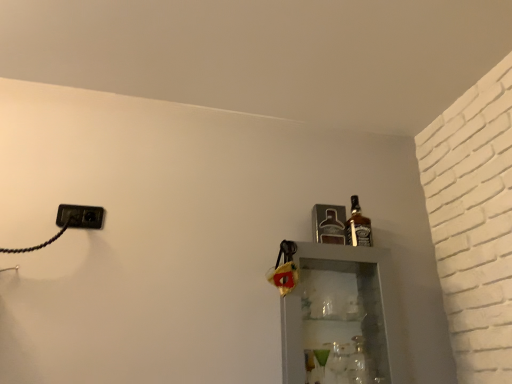
Question: Is brown glass bottle at upper right, marked as the third bottle in a bottom-to-top arrangement, outside black plastic outlet at left?

Choices:
 (A) no
 (B) yes

Answer: (B)

Question: From a real-world perspective, is brown glass bottle at upper right, marked as the 1th bottle in a top-to-bottom arrangement, physically above black plastic outlet at left?

Choices:
 (A) no
 (B) yes

Answer: (B)

Question: Is brown glass bottle at upper right, marked as the third bottle in a bottom-to-top arrangement, wider than black plastic outlet at left?

Choices:
 (A) yes
 (B) no

Answer: (A)

Question: Is brown glass bottle at upper right, marked as the 1th bottle in a top-to-bottom arrangement, oriented towards black plastic outlet at left?

Choices:
 (A) no
 (B) yes

Answer: (A)

Question: Is brown glass bottle at upper right, marked as the third bottle in a bottom-to-top arrangement, bigger than black plastic outlet at left?

Choices:
 (A) no
 (B) yes

Answer: (B)

Question: From a real-world perspective, is clear glass bottle at right, the first bottle in the bottom-to-top sequence, positioned above or below metallic silver bottle at upper right, the 2th bottle when ordered from bottom to top?

Choices:
 (A) below
 (B) above

Answer: (A)

Question: Is point (356, 380) closer or farther from the camera than point (331, 206)?

Choices:
 (A) farther
 (B) closer

Answer: (B)

Question: In terms of width, does clear glass bottle at right, marked as the third bottle in a top-to-bottom arrangement, look wider or thinner when compared to metallic silver bottle at upper right, arranged as the 2th bottle when viewed from the top?

Choices:
 (A) thin
 (B) wide

Answer: (A)

Question: Is clear glass bottle at right, marked as the third bottle in a top-to-bottom arrangement, taller or shorter than metallic silver bottle at upper right, arranged as the 2th bottle when viewed from the top?

Choices:
 (A) tall
 (B) short

Answer: (A)

Question: Is brown glass bottle at upper right, marked as the third bottle in a bottom-to-top arrangement, bigger or smaller than clear glass bottle at right, the first bottle in the bottom-to-top sequence?

Choices:
 (A) big
 (B) small

Answer: (A)

Question: From a real-world perspective, is brown glass bottle at upper right, marked as the third bottle in a bottom-to-top arrangement, above or below clear glass bottle at right, marked as the third bottle in a top-to-bottom arrangement?

Choices:
 (A) below
 (B) above

Answer: (B)

Question: Is point (354, 243) closer or farther from the camera than point (354, 365)?

Choices:
 (A) farther
 (B) closer

Answer: (A)

Question: Visually, is brown glass bottle at upper right, marked as the third bottle in a bottom-to-top arrangement, positioned to the left or to the right of clear glass bottle at right, marked as the third bottle in a top-to-bottom arrangement?

Choices:
 (A) left
 (B) right

Answer: (B)

Question: Is metallic silver bottle at upper right, arranged as the 2th bottle when viewed from the top, in front of or behind black plastic outlet at left in the image?

Choices:
 (A) behind
 (B) front

Answer: (A)

Question: From the image's perspective, is metallic silver bottle at upper right, the 2th bottle when ordered from bottom to top, located above or below black plastic outlet at left?

Choices:
 (A) above
 (B) below

Answer: (B)